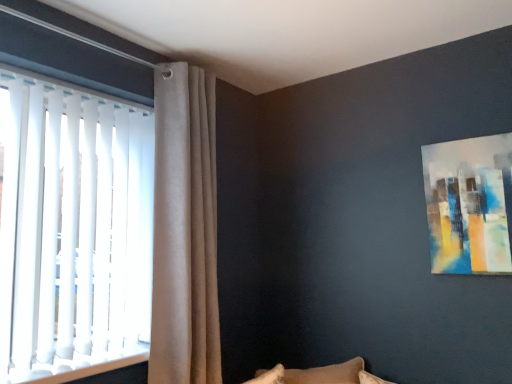
Question: Is abstract painting at upper right outside of beige velvet curtain at upper left?

Choices:
 (A) no
 (B) yes

Answer: (B)

Question: Is abstract painting at upper right smaller than beige velvet curtain at upper left?

Choices:
 (A) yes
 (B) no

Answer: (A)

Question: Is the position of abstract painting at upper right more distant than that of beige velvet curtain at upper left?

Choices:
 (A) no
 (B) yes

Answer: (A)

Question: Does abstract painting at upper right contain beige velvet curtain at upper left?

Choices:
 (A) yes
 (B) no

Answer: (B)

Question: From the image's perspective, is abstract painting at upper right above beige velvet curtain at upper left?

Choices:
 (A) no
 (B) yes

Answer: (B)

Question: Would you say white vertical blinds at left is inside or outside abstract painting at upper right?

Choices:
 (A) outside
 (B) inside

Answer: (A)

Question: Is white vertical blinds at left to the left or to the right of abstract painting at upper right in the image?

Choices:
 (A) right
 (B) left

Answer: (B)

Question: Looking at the image, does white vertical blinds at left seem bigger or smaller compared to abstract painting at upper right?

Choices:
 (A) big
 (B) small

Answer: (A)

Question: From a real-world perspective, relative to abstract painting at upper right, is white vertical blinds at left vertically above or below?

Choices:
 (A) above
 (B) below

Answer: (B)

Question: From the image's perspective, is abstract painting at upper right positioned above or below beige velvet curtain at upper left?

Choices:
 (A) above
 (B) below

Answer: (A)

Question: Looking at the image, does abstract painting at upper right seem bigger or smaller compared to beige velvet curtain at upper left?

Choices:
 (A) small
 (B) big

Answer: (A)

Question: Considering the positions of point (478, 140) and point (159, 172), is point (478, 140) closer or farther from the camera than point (159, 172)?

Choices:
 (A) closer
 (B) farther

Answer: (A)

Question: Is abstract painting at upper right in front of or behind beige velvet curtain at upper left in the image?

Choices:
 (A) front
 (B) behind

Answer: (A)

Question: From the image's perspective, relative to abstract painting at upper right, is beige velvet curtain at upper left above or below?

Choices:
 (A) above
 (B) below

Answer: (B)

Question: Visually, is beige velvet curtain at upper left positioned to the left or to the right of abstract painting at upper right?

Choices:
 (A) left
 (B) right

Answer: (A)